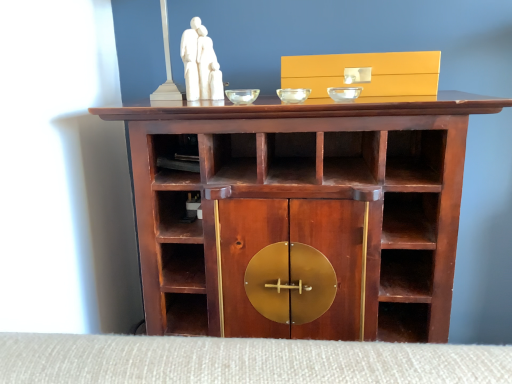
Measure the distance between transparent glass bowl at center, placed as the 1th glass bowl when sorted from left to right, and camera.

transparent glass bowl at center, placed as the 1th glass bowl when sorted from left to right, is 1.07 meters away from camera.

What do you see at coordinates (293, 95) in the screenshot?
I see `transparent glass bowl at center, positioned as the second glass bowl in right-to-left order` at bounding box center [293, 95].

What do you see at coordinates (344, 94) in the screenshot? I see `transparent glass bowl at center, acting as the first glass bowl starting from the right` at bounding box center [344, 94].

Find the location of `transparent glass bowl at center, which appears as the 3th glass bowl when viewed from the right`. transparent glass bowl at center, which appears as the 3th glass bowl when viewed from the right is located at coordinates (242, 96).

From the image's perspective, which one is positioned higher, white marble sculpture at upper center or transparent glass bowl at center, placed as the 1th glass bowl when sorted from left to right?

white marble sculpture at upper center is shown above in the image.

In terms of height, does white marble sculpture at upper center look taller or shorter compared to transparent glass bowl at center, which appears as the 3th glass bowl when viewed from the right?

Clearly, white marble sculpture at upper center is taller compared to transparent glass bowl at center, which appears as the 3th glass bowl when viewed from the right.

I want to click on sculpture above the transparent glass bowl at center, which appears as the 3th glass bowl when viewed from the right (from the image's perspective), so click(x=200, y=64).

From a real-world perspective, is white marble sculpture at upper center physically below transparent glass bowl at center, placed as the 1th glass bowl when sorted from left to right?

No, from a real-world perspective, white marble sculpture at upper center is not below transparent glass bowl at center, placed as the 1th glass bowl when sorted from left to right.

Does matte gold drawer at upper center have a larger size compared to white marble sculpture at upper center?

Yes.

Would you consider matte gold drawer at upper center to be distant from white marble sculpture at upper center?

No, matte gold drawer at upper center is not far away from white marble sculpture at upper center.

Which is more distant, [422,52] or [196,62]?

The point [196,62] is behind.

Is white marble sculpture at upper center at the back of mahogany wood cabinet at center?

mahogany wood cabinet at center does not have its back to white marble sculpture at upper center.

Is mahogany wood cabinet at center wider or thinner than white marble sculpture at upper center?

Clearly, mahogany wood cabinet at center has more width compared to white marble sculpture at upper center.

Measure the distance between mahogany wood cabinet at center and white marble sculpture at upper center.

mahogany wood cabinet at center and white marble sculpture at upper center are 38.46 centimeters apart from each other.

Is mahogany wood cabinet at center inside the boundaries of transparent glass bowl at center, positioned as the second glass bowl in right-to-left order, or outside?

mahogany wood cabinet at center is spatially situated outside transparent glass bowl at center, positioned as the second glass bowl in right-to-left order.

From their relative heights in the image, would you say mahogany wood cabinet at center is taller or shorter than transparent glass bowl at center, positioned as the second glass bowl in right-to-left order?

In the image, mahogany wood cabinet at center appears to be taller than transparent glass bowl at center, positioned as the second glass bowl in right-to-left order.

From a real-world perspective, does mahogany wood cabinet at center sit lower than transparent glass bowl at center, marked as the second glass bowl in a left-to-right arrangement?

Yes, from a real-world perspective, mahogany wood cabinet at center is below transparent glass bowl at center, marked as the second glass bowl in a left-to-right arrangement.

Is mahogany wood cabinet at center bigger or smaller than transparent glass bowl at center, marked as the second glass bowl in a left-to-right arrangement?

mahogany wood cabinet at center is bigger than transparent glass bowl at center, marked as the second glass bowl in a left-to-right arrangement.

Is the position of transparent glass bowl at center, acting as the first glass bowl starting from the right, more distant than that of matte gold drawer at upper center?

No.

From the image's perspective, is transparent glass bowl at center, which ranks as the 3th glass bowl in left-to-right order, located above matte gold drawer at upper center?

No, from the image's perspective, transparent glass bowl at center, which ranks as the 3th glass bowl in left-to-right order, is not over matte gold drawer at upper center.

Where is `cabinetry located above the transparent glass bowl at center, acting as the first glass bowl starting from the right (from a real-world perspective)`? The image size is (512, 384). cabinetry located above the transparent glass bowl at center, acting as the first glass bowl starting from the right (from a real-world perspective) is located at coordinates (371, 73).

Which is closer, (237, 95) or (384, 85)?

The point (384, 85) is more forward.

Does transparent glass bowl at center, which appears as the 3th glass bowl when viewed from the right, contain matte gold drawer at upper center?

No, matte gold drawer at upper center is not surrounded by transparent glass bowl at center, which appears as the 3th glass bowl when viewed from the right.

What are the coordinates of `the 3rd glass bowl to the left when counting from the matte gold drawer at upper center` in the screenshot? It's located at (242, 96).

Looking at this image, are transparent glass bowl at center, which appears as the 3th glass bowl when viewed from the right, and matte gold drawer at upper center located far from each other?

No, transparent glass bowl at center, which appears as the 3th glass bowl when viewed from the right, is not far away from matte gold drawer at upper center.

From a real-world perspective, is transparent glass bowl at center, marked as the second glass bowl in a left-to-right arrangement, positioned above or below mahogany wood cabinet at center?

transparent glass bowl at center, marked as the second glass bowl in a left-to-right arrangement, is above mahogany wood cabinet at center.

Does transparent glass bowl at center, positioned as the second glass bowl in right-to-left order, contain mahogany wood cabinet at center?

No, mahogany wood cabinet at center is located outside of transparent glass bowl at center, positioned as the second glass bowl in right-to-left order.

From the image's perspective, which object appears higher, transparent glass bowl at center, positioned as the second glass bowl in right-to-left order, or mahogany wood cabinet at center?

transparent glass bowl at center, positioned as the second glass bowl in right-to-left order, is shown above in the image.

Is transparent glass bowl at center, marked as the second glass bowl in a left-to-right arrangement, in contact with mahogany wood cabinet at center?

No, transparent glass bowl at center, marked as the second glass bowl in a left-to-right arrangement, is not in contact with mahogany wood cabinet at center.

At what (x,y) coordinates should I click in order to perform the action: click on the 1st glass bowl below the white marble sculpture at upper center (from the image's perspective). Please return your answer as a coordinate pair (x, y). Looking at the image, I should click on (242, 96).

Where is `sculpture behind the matte gold drawer at upper center`? sculpture behind the matte gold drawer at upper center is located at coordinates (200, 64).

Consider the image. Considering their positions, is transparent glass bowl at center, placed as the 1th glass bowl when sorted from left to right, positioned further to matte gold drawer at upper center than transparent glass bowl at center, acting as the first glass bowl starting from the right?

transparent glass bowl at center, placed as the 1th glass bowl when sorted from left to right, lies further to matte gold drawer at upper center than the other object.

Looking at the image, which one is located closer to matte gold drawer at upper center, transparent glass bowl at center, positioned as the second glass bowl in right-to-left order, or mahogany wood cabinet at center?

transparent glass bowl at center, positioned as the second glass bowl in right-to-left order, is closer to matte gold drawer at upper center.

From the picture: Based on their spatial positions, is matte gold drawer at upper center or transparent glass bowl at center, marked as the second glass bowl in a left-to-right arrangement, closer to transparent glass bowl at center, acting as the first glass bowl starting from the right?

Among the two, matte gold drawer at upper center is located nearer to transparent glass bowl at center, acting as the first glass bowl starting from the right.

Which object lies nearer to the anchor point mahogany wood cabinet at center, white marble sculpture at upper center or transparent glass bowl at center, which appears as the 3th glass bowl when viewed from the right?

transparent glass bowl at center, which appears as the 3th glass bowl when viewed from the right, is positioned closer to the anchor mahogany wood cabinet at center.

Looking at the image, which one is located closer to mahogany wood cabinet at center, transparent glass bowl at center, which ranks as the 3th glass bowl in left-to-right order, or transparent glass bowl at center, which appears as the 3th glass bowl when viewed from the right?

transparent glass bowl at center, which ranks as the 3th glass bowl in left-to-right order, is closer to mahogany wood cabinet at center.

Which object lies further to the anchor point transparent glass bowl at center, placed as the 1th glass bowl when sorted from left to right, transparent glass bowl at center, marked as the second glass bowl in a left-to-right arrangement, or white marble sculpture at upper center?

transparent glass bowl at center, marked as the second glass bowl in a left-to-right arrangement, lies further to transparent glass bowl at center, placed as the 1th glass bowl when sorted from left to right, than the other object.

Considering their positions, is transparent glass bowl at center, acting as the first glass bowl starting from the right, positioned closer to transparent glass bowl at center, positioned as the second glass bowl in right-to-left order, than mahogany wood cabinet at center?

transparent glass bowl at center, acting as the first glass bowl starting from the right, is positioned closer to the anchor transparent glass bowl at center, positioned as the second glass bowl in right-to-left order.

Based on their spatial positions, is transparent glass bowl at center, positioned as the second glass bowl in right-to-left order, or white marble sculpture at upper center further from matte gold drawer at upper center?

white marble sculpture at upper center.

Identify the location of glass bowl between white marble sculpture at upper center and transparent glass bowl at center, marked as the second glass bowl in a left-to-right arrangement, from left to right. The height and width of the screenshot is (384, 512). (242, 96).

I want to click on glass bowl between transparent glass bowl at center, positioned as the second glass bowl in right-to-left order, and mahogany wood cabinet at center from top to bottom, so click(344, 94).

I want to click on glass bowl between transparent glass bowl at center, which appears as the 3th glass bowl when viewed from the right, and transparent glass bowl at center, acting as the first glass bowl starting from the right, so click(293, 95).

Where is `glass bowl between transparent glass bowl at center, positioned as the second glass bowl in right-to-left order, and matte gold drawer at upper center, in the horizontal direction`? glass bowl between transparent glass bowl at center, positioned as the second glass bowl in right-to-left order, and matte gold drawer at upper center, in the horizontal direction is located at coordinates click(x=344, y=94).